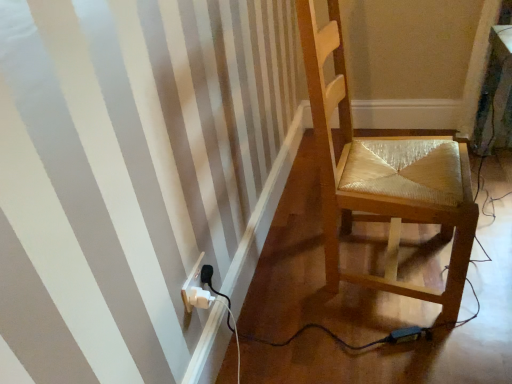
Locate an element on the screen. free location to the left of wooden chair at right is located at coordinates (285, 292).